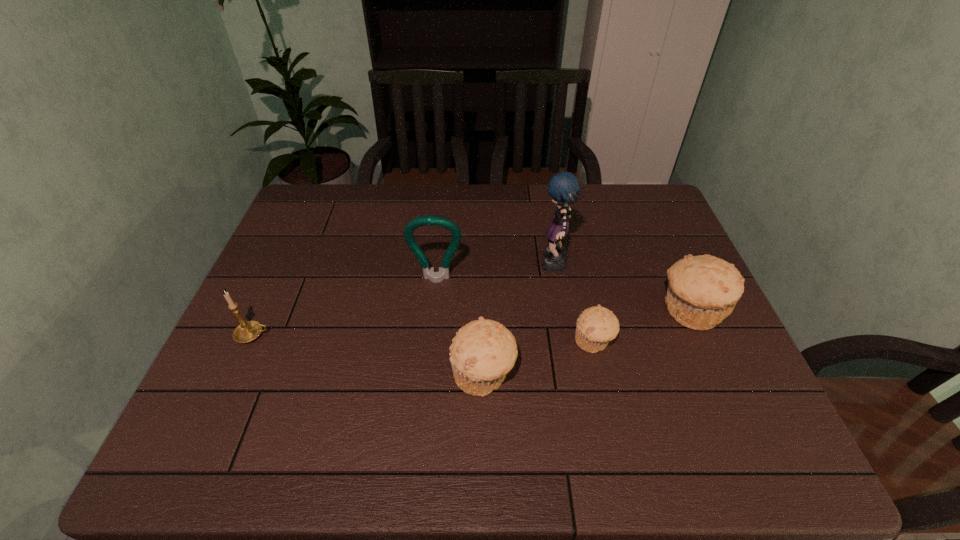
Identify the location of free point that keeps the muffins evenly spaced on the left. The image size is (960, 540). (357, 414).